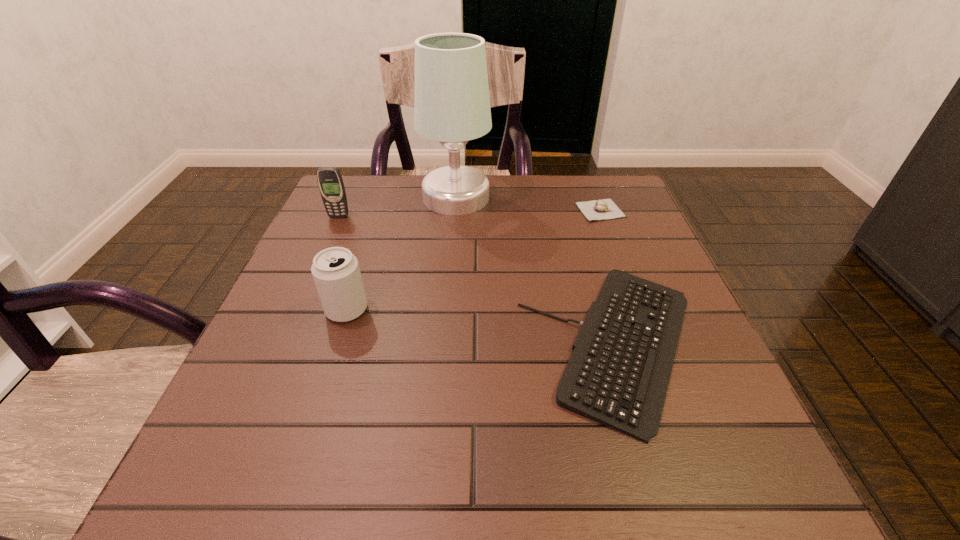
The image size is (960, 540). What are the coordinates of `free space between the third object from left to right and the can` in the screenshot? It's located at (401, 254).

Find the location of a particular element. free spot between the third object from left to right and the fourth object from right to left is located at coordinates (401, 254).

Locate an element on the screen. free area in between the third object from right to left and the computer keyboard is located at coordinates (536, 271).

The height and width of the screenshot is (540, 960). Find the location of `object that is the second closest to the tallest object`. object that is the second closest to the tallest object is located at coordinates (603, 209).

Locate which object is the closest to the cellular telephone. Please provide its 2D coordinates. Your answer should be formatted as a tuple, i.e. [(x, y)], where the tuple contains the x and y coordinates of a point satisfying the conditions above.

[(452, 105)]

Where is `free region that satisfies the following two spatial constraints: 1. on the base of the computer keyboard; 2. on the right side of the third object from left to right`? Image resolution: width=960 pixels, height=540 pixels. free region that satisfies the following two spatial constraints: 1. on the base of the computer keyboard; 2. on the right side of the third object from left to right is located at coordinates 444,344.

Locate an element on the screen. Image resolution: width=960 pixels, height=540 pixels. free space that satisfies the following two spatial constraints: 1. on the base of the lampshade; 2. on the screen of the cellular telephone is located at coordinates (454, 217).

At what (x,y) coordinates should I click in order to perform the action: click on vacant region that satisfies the following two spatial constraints: 1. on the base of the third object from right to left; 2. on the right side of the fourth tallest object. Please return your answer as a coordinate pair (x, y). Looking at the image, I should click on (455, 210).

Find the location of `vacant space that satisfies the following two spatial constraints: 1. on the screen of the leftmost object; 2. on the right side of the can`. vacant space that satisfies the following two spatial constraints: 1. on the screen of the leftmost object; 2. on the right side of the can is located at coordinates (299, 310).

You are a GUI agent. You are given a task and a screenshot of the screen. Output one action in this format:
    pyautogui.click(x=<x>, y=<y>)
    Task: Click on the vacant area in the image that satisfies the following two spatial constraints: 1. on the back side of the shortest object; 2. on the left side of the second shortest object
    
    Given the screenshot: What is the action you would take?
    pyautogui.click(x=575, y=210)